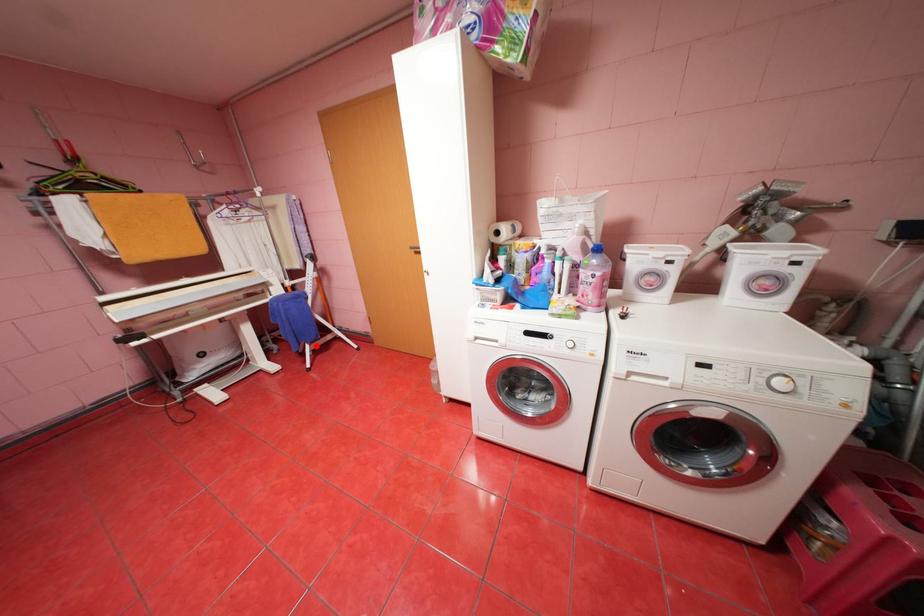
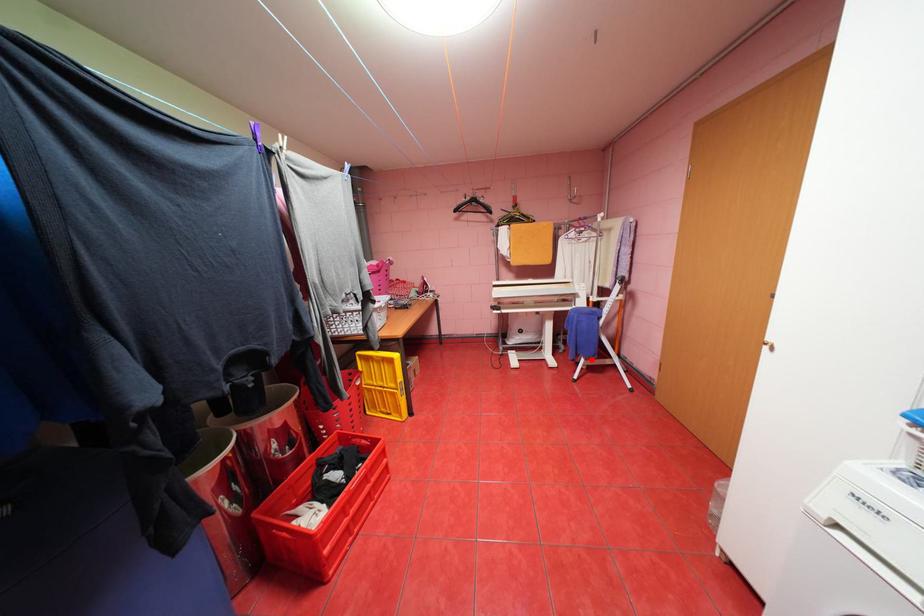
I am providing you with two images of the same scene from different viewpoints. A red point is marked on the first image and another point is marked on the second image. Do the highlighted points in image1 and image2 indicate the same real-world spot?

Yes